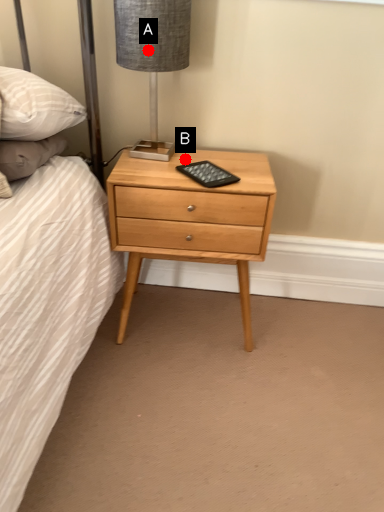
Question: Two points are circled on the image, labeled by A and B beside each circle. Which point appears closest to the camera in this image?

Choices:
 (A) A is closer
 (B) B is closer

Answer: (A)